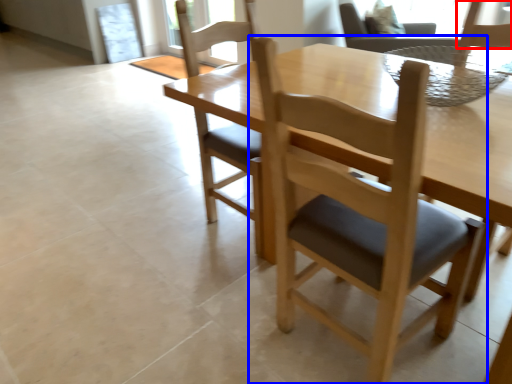
Question: Which of the following is the farthest to the observer, chair (highlighted by a red box) or chair (highlighted by a blue box)?

Choices:
 (A) chair
 (B) chair

Answer: (A)